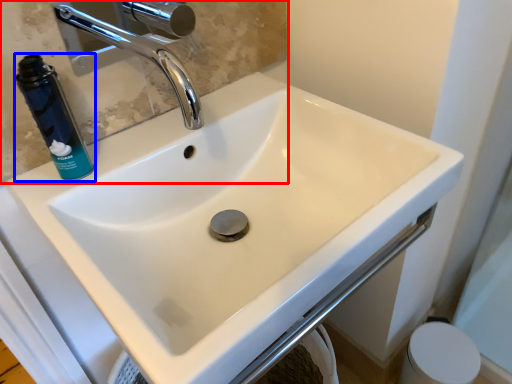
Question: Which of the following is the farthest to the observer, mirror (highlighted by a red box) or mouthwash (highlighted by a blue box)?

Choices:
 (A) mirror
 (B) mouthwash

Answer: (B)